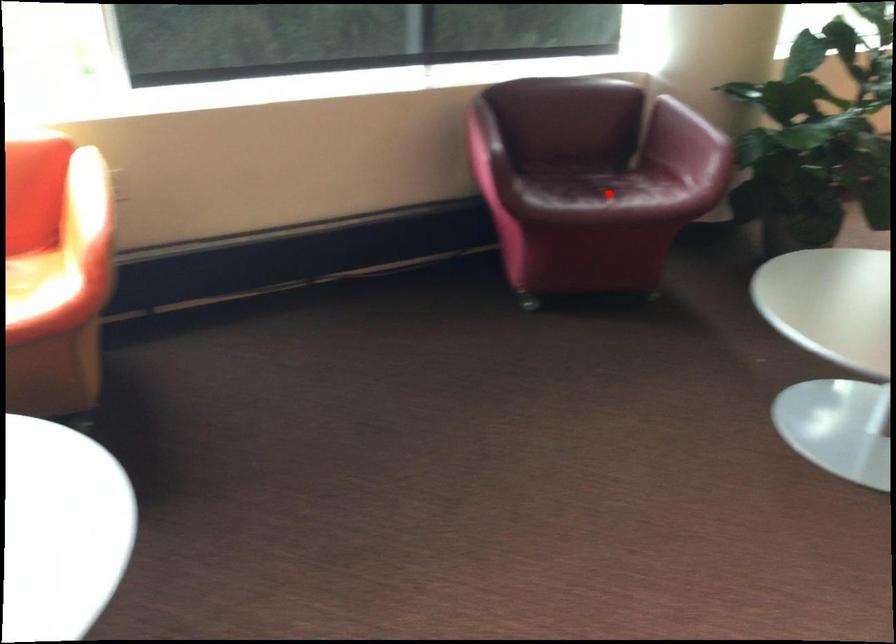
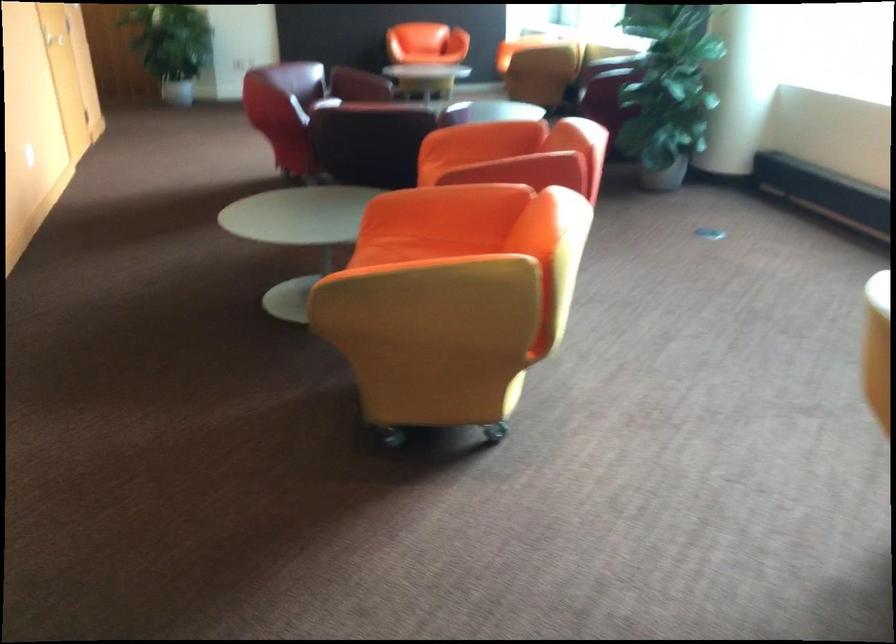
Question: I am providing you with two images of the same scene from different viewpoints. A red point is marked on the first image. Can you still see the location of the red point in image 2?

Choices:
 (A) Yes
 (B) No

Answer: (B)